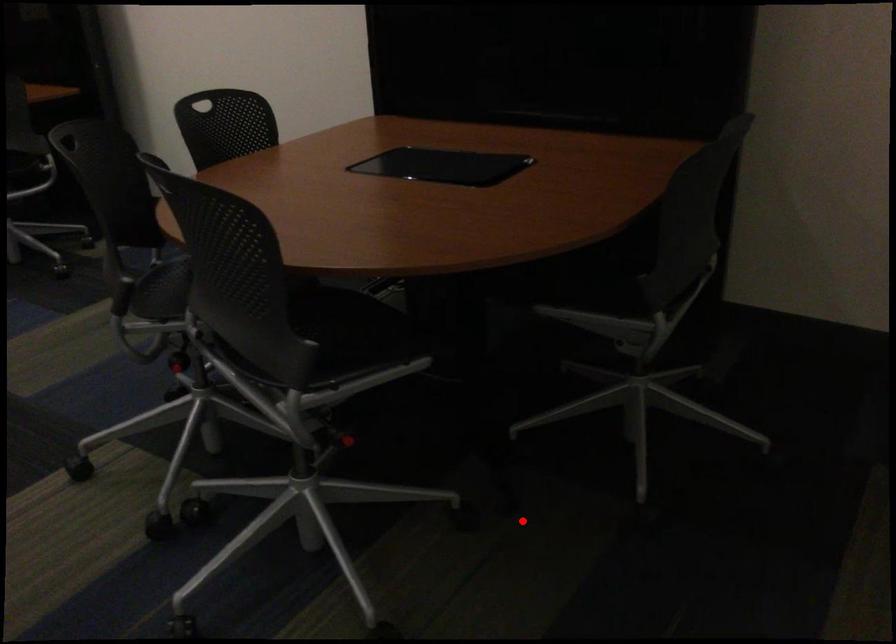
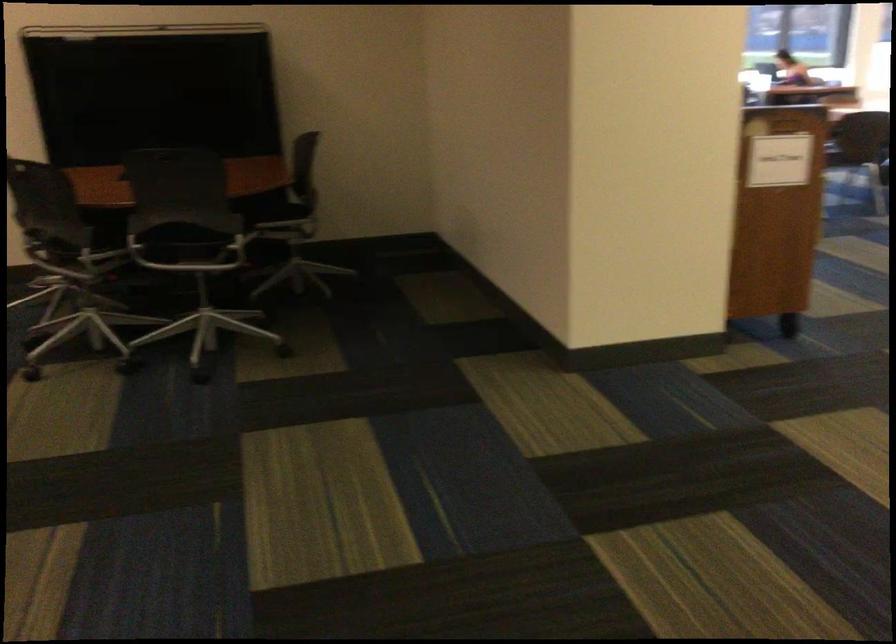
The point at the highlighted location is marked in the first image. Where is the corresponding point in the second image?

(256, 237)